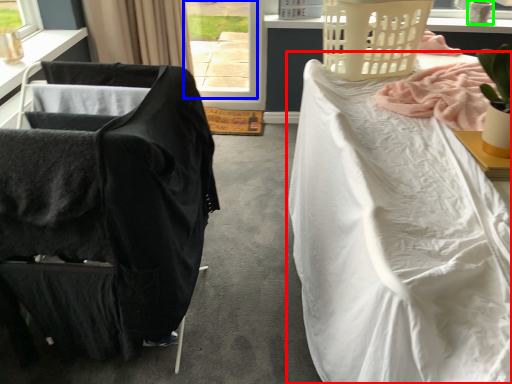
Question: Which is nearer to the bed (highlighted by a red box)? window (highlighted by a blue box) or lamp (highlighted by a green box).

Choices:
 (A) window
 (B) lamp

Answer: (B)